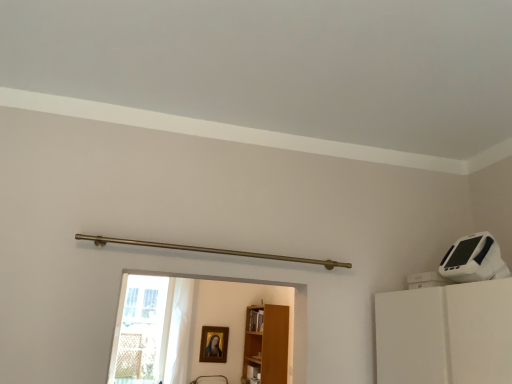
Looking at this image, what is the approximate height of transparent glass door at lower left?

transparent glass door at lower left is 4.42 feet tall.

In order to click on transparent glass door at lower left in this screenshot , I will do `click(141, 330)`.

The image size is (512, 384). What are the coordinates of `light brown wood bookshelf at center` in the screenshot? It's located at (267, 343).

This screenshot has height=384, width=512. Find the location of `transparent glass door at lower left`. transparent glass door at lower left is located at coordinates (141, 330).

Is point (250, 330) behind point (142, 291)?

That is True.

From a real-world perspective, between light brown wood bookshelf at center and transparent glass door at lower left, who is vertically higher?

transparent glass door at lower left, from a real-world perspective.

Is transparent glass door at lower left at the back of light brown wood bookshelf at center?

light brown wood bookshelf at center does not have its back to transparent glass door at lower left.

Considering the sizes of objects light brown wood bookshelf at center and transparent glass door at lower left in the image provided, who is taller, light brown wood bookshelf at center or transparent glass door at lower left?

Standing taller between the two is transparent glass door at lower left.

Considering the relative positions of light brown wood bookshelf at center and gold-framed portrait at center in the image provided, is light brown wood bookshelf at center behind gold-framed portrait at center?

No, it is not.

Based on the photo, is light brown wood bookshelf at center to the left or to the right of gold-framed portrait at center in the image?

In the image, light brown wood bookshelf at center appears on the right side of gold-framed portrait at center.

Where is `furniture above the gold-framed portrait at center (from the image's perspective)`? Image resolution: width=512 pixels, height=384 pixels. furniture above the gold-framed portrait at center (from the image's perspective) is located at coordinates (267, 343).

This screenshot has width=512, height=384. What are the coordinates of `glass door on the left of light brown wood bookshelf at center` in the screenshot? It's located at (141, 330).

From their relative heights in the image, would you say transparent glass door at lower left is taller or shorter than light brown wood bookshelf at center?

Clearly, transparent glass door at lower left is taller compared to light brown wood bookshelf at center.

Which of these two, transparent glass door at lower left or light brown wood bookshelf at center, is wider?

With larger width is light brown wood bookshelf at center.

From the image's perspective, is transparent glass door at lower left beneath light brown wood bookshelf at center?

Actually, transparent glass door at lower left appears above light brown wood bookshelf at center in the image.

Is transparent glass door at lower left at the back of gold-framed portrait at center?

No, gold-framed portrait at center's orientation is not away from transparent glass door at lower left.

Is the surface of gold-framed portrait at center in direct contact with transparent glass door at lower left?

gold-framed portrait at center and transparent glass door at lower left are clearly separated.

Based on the photo, what's the angular difference between gold-framed portrait at center and transparent glass door at lower left's facing directions?

The facing directions of gold-framed portrait at center and transparent glass door at lower left are 0.00257 degrees apart.

Is gold-framed portrait at center positioned beyond the bounds of transparent glass door at lower left?

Yes.

Considering the points (222, 347) and (288, 319), which point is in front, point (222, 347) or point (288, 319)?

Positioned in front is point (222, 347).

Is gold-framed portrait at center next to light brown wood bookshelf at center?

gold-framed portrait at center and light brown wood bookshelf at center are clearly separated.

Does gold-framed portrait at center appear on the left side of light brown wood bookshelf at center?

Yes.

From a real-world perspective, is transparent glass door at lower left positioned above or below gold-framed portrait at center?

In terms of real-world spatial position, transparent glass door at lower left is above gold-framed portrait at center.

Is transparent glass door at lower left next to gold-framed portrait at center and touching it?

No, transparent glass door at lower left is not with gold-framed portrait at center.

Between transparent glass door at lower left and gold-framed portrait at center, which one appears on the right side from the viewer's perspective?

Positioned to the right is gold-framed portrait at center.

Which is nearer, (129, 352) or (226, 345)?

Clearly, point (129, 352) is closer to the camera than point (226, 345).

Identify the location of furniture below the transparent glass door at lower left (from a real-world perspective). (267, 343).

Where is `furniture above the gold-framed portrait at center (from a real-world perspective)`? furniture above the gold-framed portrait at center (from a real-world perspective) is located at coordinates (267, 343).

Looking at the image, which one is located further to light brown wood bookshelf at center, transparent glass door at lower left or gold-framed portrait at center?

transparent glass door at lower left lies further to light brown wood bookshelf at center than the other object.

Estimate the real-world distances between objects in this image. Which object is closer to transparent glass door at lower left, gold-framed portrait at center or light brown wood bookshelf at center?

Based on the image, gold-framed portrait at center appears to be nearer to transparent glass door at lower left.

Which object lies nearer to the anchor point gold-framed portrait at center, light brown wood bookshelf at center or transparent glass door at lower left?

light brown wood bookshelf at center is positioned closer to the anchor gold-framed portrait at center.

From the image, which object appears to be nearer to gold-framed portrait at center, transparent glass door at lower left or light brown wood bookshelf at center?

Among the two, light brown wood bookshelf at center is located nearer to gold-framed portrait at center.

Based on their spatial positions, is gold-framed portrait at center or transparent glass door at lower left closer to light brown wood bookshelf at center?

Based on the image, gold-framed portrait at center appears to be nearer to light brown wood bookshelf at center.

Which object lies further to the anchor point transparent glass door at lower left, light brown wood bookshelf at center or gold-framed portrait at center?

light brown wood bookshelf at center lies further to transparent glass door at lower left than the other object.

At what (x,y) coordinates should I click in order to perform the action: click on picture frame between transparent glass door at lower left and light brown wood bookshelf at center from left to right. Please return your answer as a coordinate pair (x, y). The image size is (512, 384). Looking at the image, I should click on (214, 344).